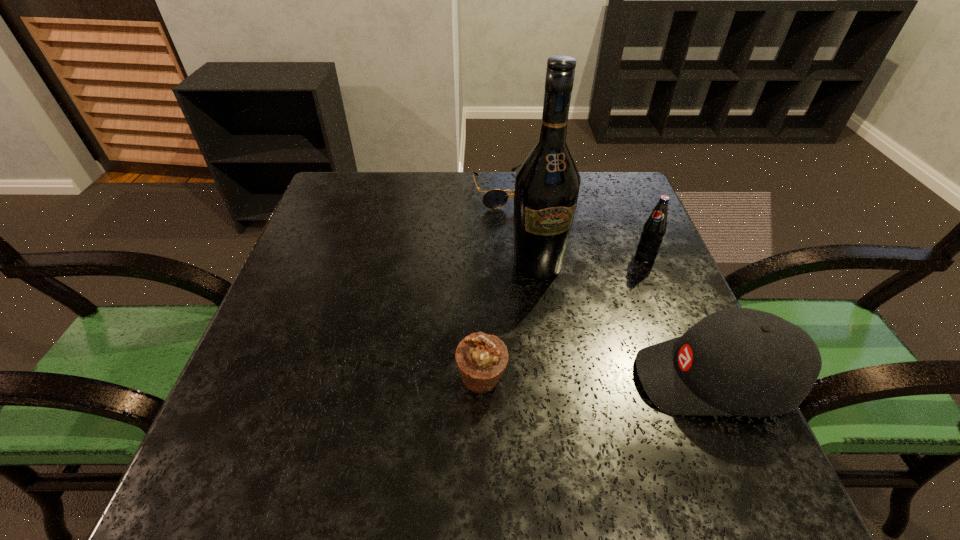
I want to click on muffin, so click(481, 359).

The width and height of the screenshot is (960, 540). What are the coordinates of `baseball cap` in the screenshot? It's located at (x=735, y=362).

At what (x,y) coordinates should I click in order to perform the action: click on the shortest object. Please return your answer as a coordinate pair (x, y). Looking at the image, I should click on (495, 198).

Identify the location of sunglasses. (495, 198).

Locate an element on the screen. The image size is (960, 540). the tallest object is located at coordinates (547, 183).

What are the coordinates of `pop` in the screenshot? It's located at (654, 228).

Identify the location of blank space located 0.240m on the right of the muffin. This screenshot has height=540, width=960. (636, 379).

This screenshot has height=540, width=960. In order to click on free space located with a logo on the front of the baseball cap in this screenshot , I will do `click(588, 379)`.

Image resolution: width=960 pixels, height=540 pixels. I want to click on free space located with a logo on the front of the baseball cap, so click(501, 379).

This screenshot has height=540, width=960. Identify the location of vacant space located with a logo on the front of the baseball cap. (496, 379).